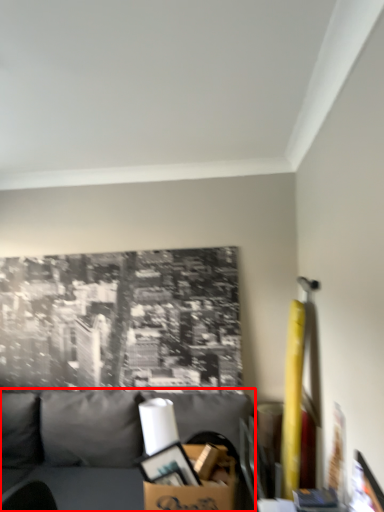
Question: From the image's perspective, where is studio couch (annotated by the red box) located relative to cardboard box?

Choices:
 (A) below
 (B) above

Answer: (A)